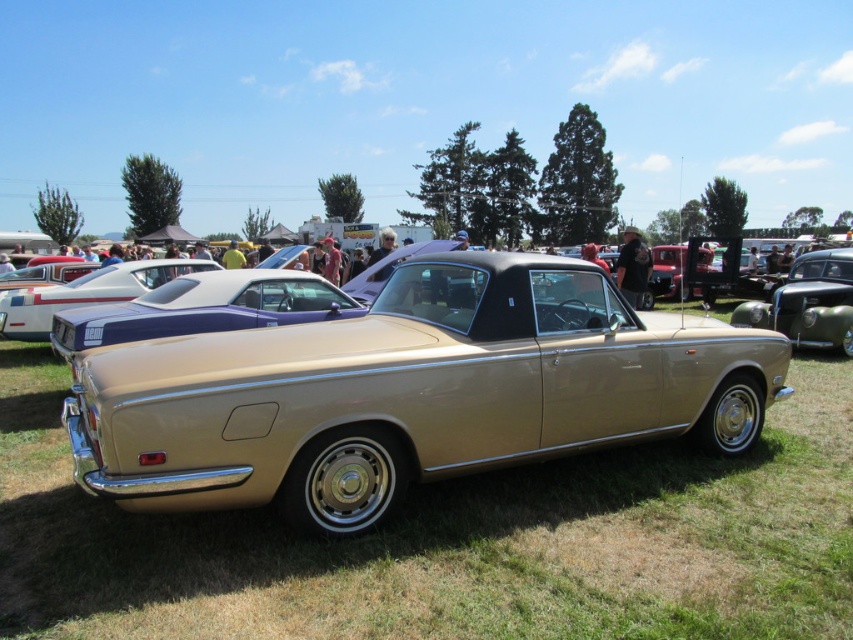
Between point (202, 483) and point (7, 330), which one is positioned in front?

Positioned in front is point (202, 483).

Which is below, gold metallic convertible at center or shiny blue car at center?

gold metallic convertible at center is lower down.

Is point (410, 262) more distant than point (28, 317)?

No, (410, 262) is closer to viewer.

You are a GUI agent. You are given a task and a screenshot of the screen. Output one action in this format:
    pyautogui.click(x=<x>, y=<y>)
    Task: Click on the gold metallic convertible at center
    This screenshot has width=853, height=640.
    Given the screenshot: What is the action you would take?
    pyautogui.click(x=410, y=392)

Does metallic gold car at center appear over shiny blue car at center?

Indeed, metallic gold car at center is positioned over shiny blue car at center.

Is metallic gold car at center to the right of shiny blue car at center from the viewer's perspective?

Indeed, metallic gold car at center is positioned on the right side of shiny blue car at center.

Which is behind, point (735, 307) or point (175, 268)?

The point (735, 307) is behind.

The height and width of the screenshot is (640, 853). Identify the location of metallic gold car at center. (808, 301).

Is gold metallic convertible at center positioned behind metallic gold car at center?

No, gold metallic convertible at center is closer to the viewer.

Is gold metallic convertible at center above metallic gold car at center?

Actually, gold metallic convertible at center is below metallic gold car at center.

At what (x,y) coordinates should I click in order to perform the action: click on gold metallic convertible at center. Please return your answer as a coordinate pair (x, y). Looking at the image, I should click on (410, 392).

Where is `gold metallic convertible at center`? The height and width of the screenshot is (640, 853). gold metallic convertible at center is located at coordinates (410, 392).